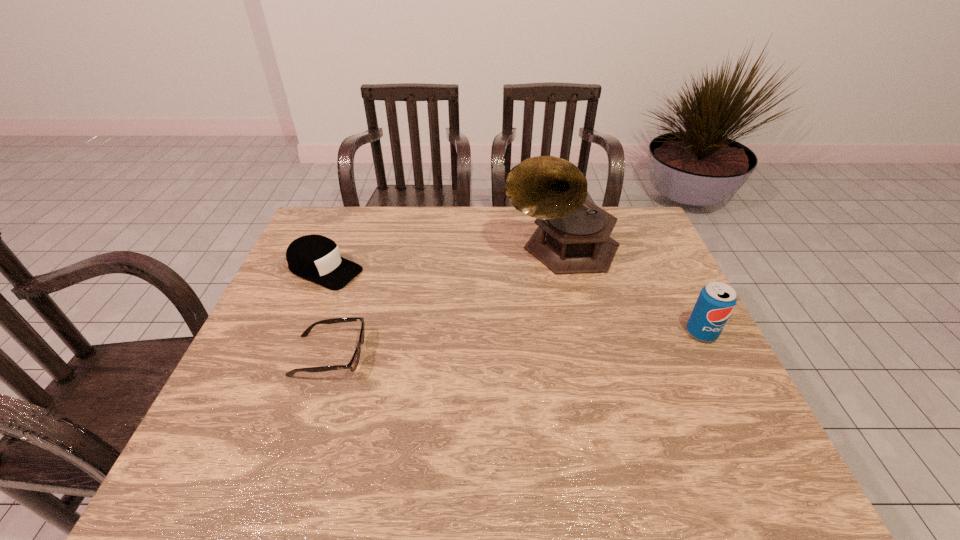
The width and height of the screenshot is (960, 540). I want to click on the shortest object, so click(352, 365).

This screenshot has width=960, height=540. What are the coordinates of `the second tallest object` in the screenshot? It's located at (716, 301).

Where is `the rightmost object`? the rightmost object is located at coordinates (716, 301).

The width and height of the screenshot is (960, 540). I want to click on phonograph record, so click(573, 236).

Where is `the tallest object`? the tallest object is located at coordinates (573, 236).

Identify the location of cap. This screenshot has width=960, height=540. (316, 258).

At what (x,y) coordinates should I click in order to perform the action: click on vacant space located 0.380m on the lenses of the shortest object. Please return your answer as a coordinate pair (x, y). The width and height of the screenshot is (960, 540). Looking at the image, I should click on (517, 355).

Where is `vacant space located on the left of the second tallest object`? vacant space located on the left of the second tallest object is located at coordinates (617, 333).

You are a GUI agent. You are given a task and a screenshot of the screen. Output one action in this format:
    pyautogui.click(x=<x>, y=<y>)
    Task: Click on the free point located on the horn direction of the second object from right to left
    The image size is (960, 540).
    Given the screenshot: What is the action you would take?
    pyautogui.click(x=508, y=327)

Where is `vacant region located on the horn direction of the second object from right to left`? vacant region located on the horn direction of the second object from right to left is located at coordinates 514,318.